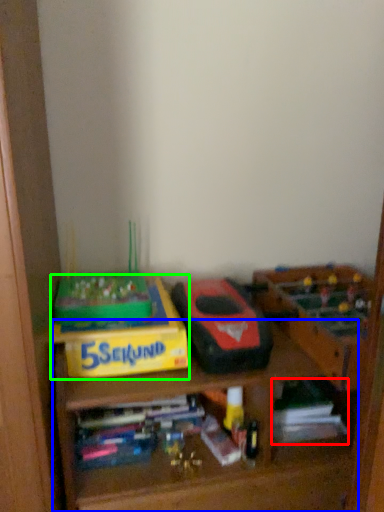
Question: Based on their relative distances, which object is nearer to book (highlighted by a red box)? Choose from shelf (highlighted by a blue box) and cardboard box (highlighted by a green box).

Choices:
 (A) shelf
 (B) cardboard box

Answer: (A)